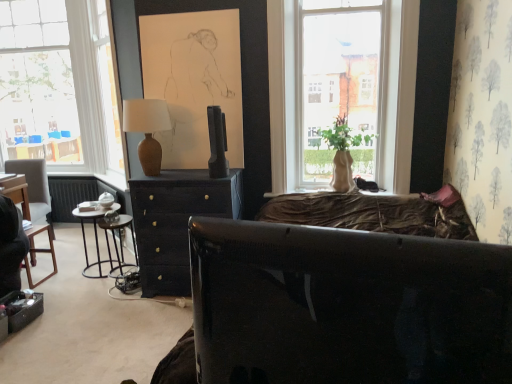
Question: Could you tell me if dark gray fabric chair at left is turned towards matte brown vase at center?

Choices:
 (A) yes
 (B) no

Answer: (B)

Question: From a real-world perspective, is dark gray fabric chair at left over matte brown vase at center?

Choices:
 (A) no
 (B) yes

Answer: (A)

Question: Is the position of dark gray fabric chair at left more distant than that of matte brown vase at center?

Choices:
 (A) no
 (B) yes

Answer: (B)

Question: Considering the relative sizes of dark gray fabric chair at left and matte brown vase at center in the image provided, is dark gray fabric chair at left thinner than matte brown vase at center?

Choices:
 (A) no
 (B) yes

Answer: (A)

Question: Is dark gray fabric chair at left taller than matte brown vase at center?

Choices:
 (A) yes
 (B) no

Answer: (A)

Question: Relative to transparent glass window at left, is matte brown vase at center in front or behind?

Choices:
 (A) behind
 (B) front

Answer: (B)

Question: Visually, is matte brown vase at center positioned to the left or to the right of transparent glass window at left?

Choices:
 (A) left
 (B) right

Answer: (B)

Question: From a real-world perspective, is matte brown vase at center positioned above or below transparent glass window at left?

Choices:
 (A) above
 (B) below

Answer: (B)

Question: Is matte brown vase at center situated inside transparent glass window at left or outside?

Choices:
 (A) inside
 (B) outside

Answer: (B)

Question: Is glossy black studio couch at center situated inside transparent glass window at left or outside?

Choices:
 (A) inside
 (B) outside

Answer: (B)

Question: From their relative heights in the image, would you say glossy black studio couch at center is taller or shorter than transparent glass window at left?

Choices:
 (A) short
 (B) tall

Answer: (A)

Question: Is glossy black studio couch at center bigger or smaller than transparent glass window at left?

Choices:
 (A) small
 (B) big

Answer: (A)

Question: From the image's perspective, is glossy black studio couch at center above or below transparent glass window at left?

Choices:
 (A) below
 (B) above

Answer: (A)

Question: Is glossy black studio couch at center inside the boundaries of matte beige vase at window, or outside?

Choices:
 (A) outside
 (B) inside

Answer: (A)

Question: From a real-world perspective, is glossy black studio couch at center physically located above or below matte beige vase at window?

Choices:
 (A) below
 (B) above

Answer: (A)